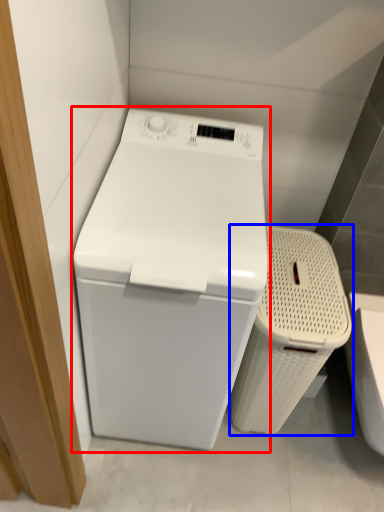
Question: Which object appears closest to the camera in this image, washing machine (highlighted by a red box) or laundry basket (highlighted by a blue box)?

Choices:
 (A) washing machine
 (B) laundry basket

Answer: (A)